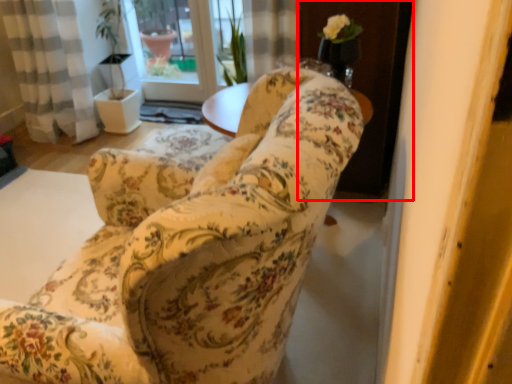
Question: In this image, where is screen door (annotated by the red box) located relative to chair?

Choices:
 (A) left
 (B) right

Answer: (B)